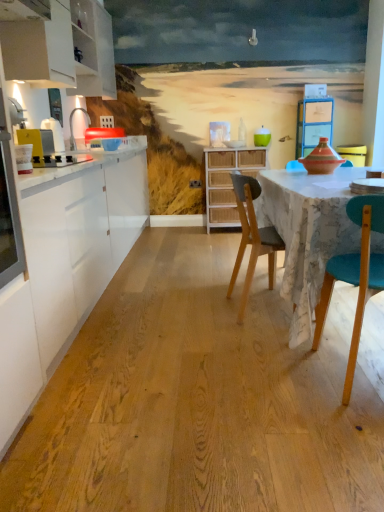
Find the location of a particular element. vacant space underneath wooden chair at center (from a real-world perspective) is located at coordinates (263, 311).